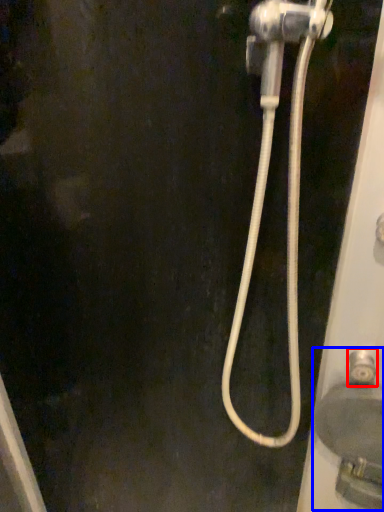
Question: Which object is further to the camera taking this photo, faucet (highlighted by a red box) or sink (highlighted by a blue box)?

Choices:
 (A) faucet
 (B) sink

Answer: (A)